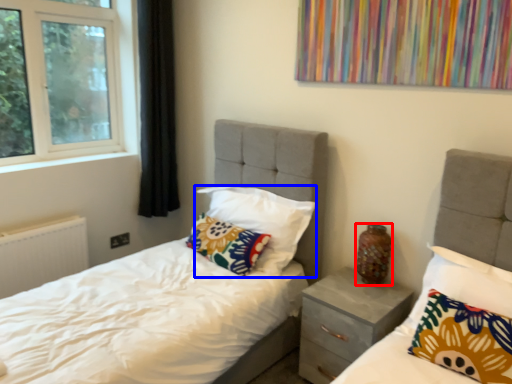
Question: Which object is closer to the camera taking this photo, vase (highlighted by a red box) or pillow (highlighted by a blue box)?

Choices:
 (A) vase
 (B) pillow

Answer: (A)